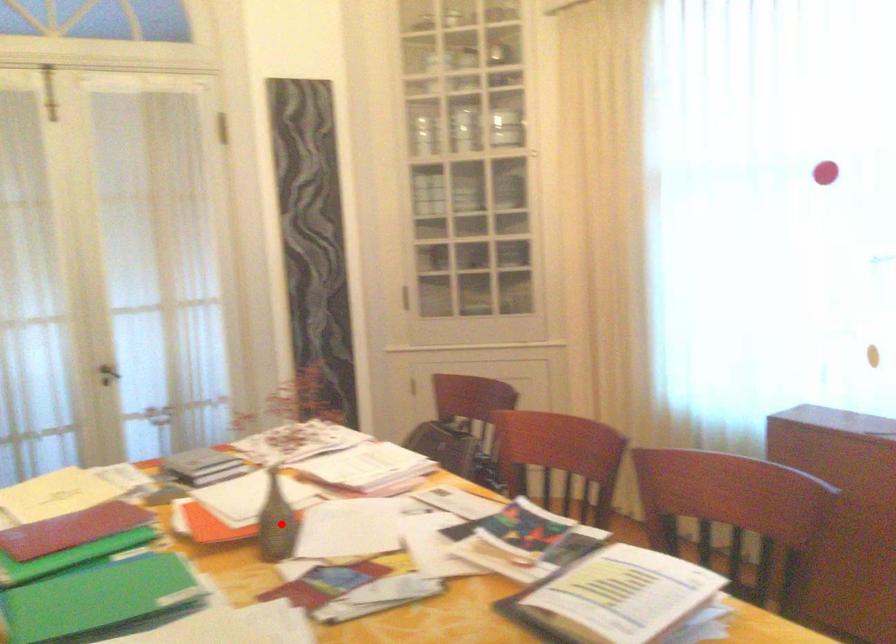
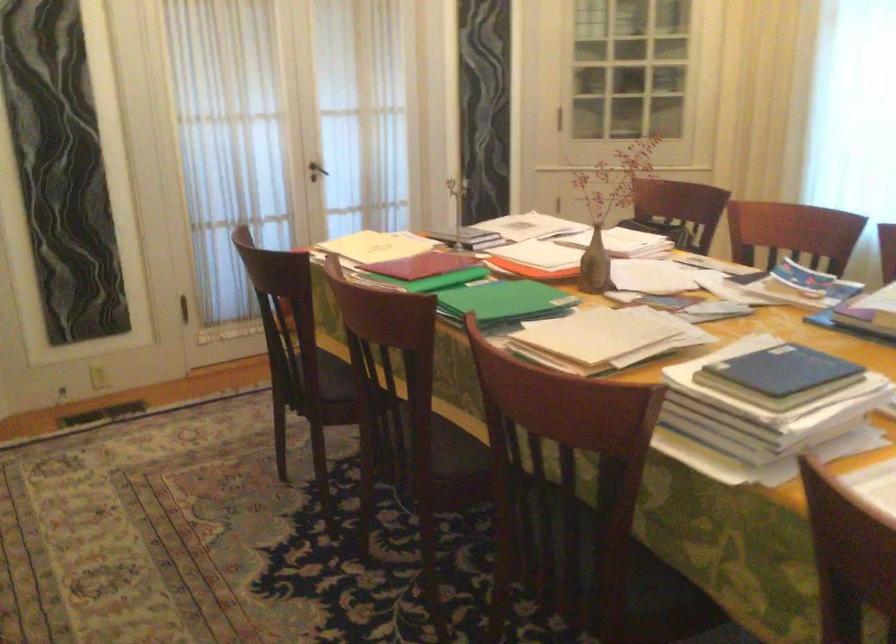
Find the pixel in the second image that matches the highlighted location in the first image.

(595, 265)